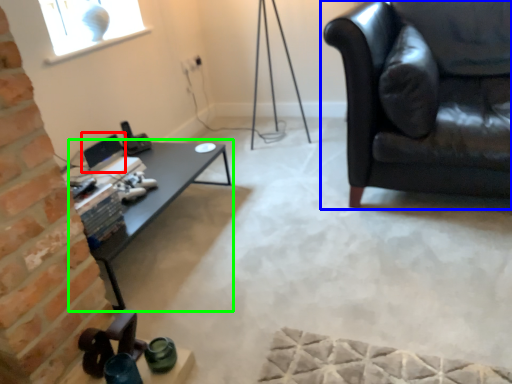
Question: Which object is the farthest from computer monitor (highlighted by a red box)? Choose among these: studio couch (highlighted by a blue box) or table (highlighted by a green box).

Choices:
 (A) studio couch
 (B) table

Answer: (A)